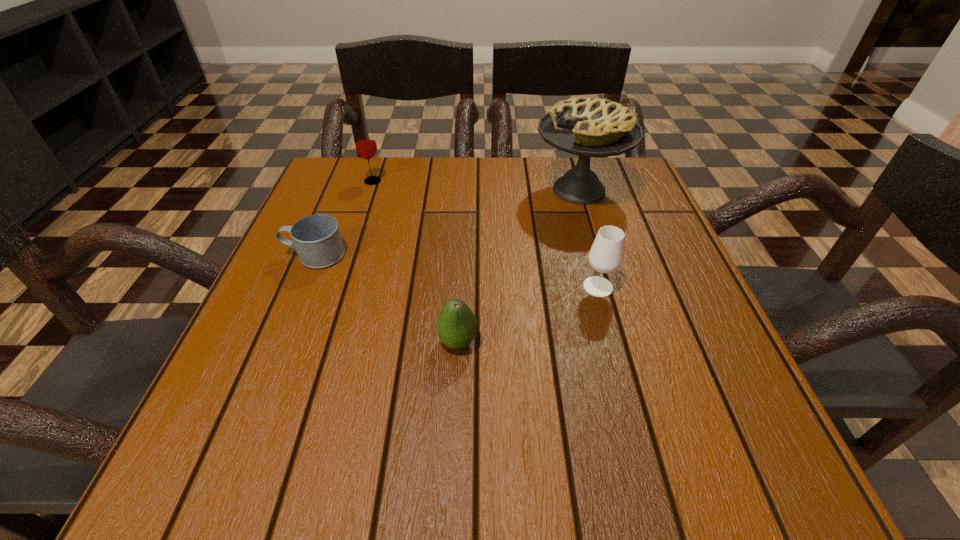
Locate an element on the screen. blank area located on the cut side of the tallest object is located at coordinates (377, 190).

I want to click on vacant space located on the front of the farther glass, so click(x=365, y=205).

The width and height of the screenshot is (960, 540). Identify the location of free space located on the left of the right glass. pyautogui.click(x=373, y=287).

Where is `blank area located 0.170m on the back of the fourth tallest object`? The image size is (960, 540). blank area located 0.170m on the back of the fourth tallest object is located at coordinates (462, 262).

Find the location of a particular element. pie that is at the far edge is located at coordinates (584, 126).

Find the location of `glass positioned at the far edge`. glass positioned at the far edge is located at coordinates (365, 143).

This screenshot has height=540, width=960. What are the coordinates of `glass that is positioned at the left edge` in the screenshot? It's located at (365, 143).

Identify the location of mug present at the left edge. (316, 238).

This screenshot has height=540, width=960. In order to click on pie that is at the right edge in this screenshot , I will do `click(584, 126)`.

This screenshot has height=540, width=960. In order to click on glass present at the right edge in this screenshot , I will do `click(606, 254)`.